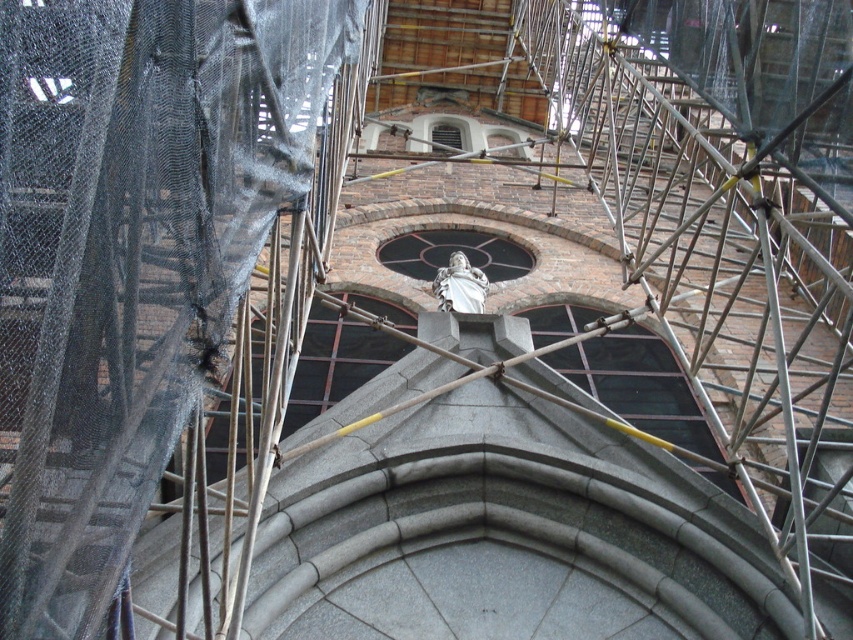
Is point (148, 93) positioned in front of point (453, 278)?

Yes.

Does metal scaffolding at center appear on the right side of white marble statue at center?

No, metal scaffolding at center is not to the right of white marble statue at center.

Locate an element on the screen. Image resolution: width=853 pixels, height=640 pixels. metal scaffolding at center is located at coordinates (131, 252).